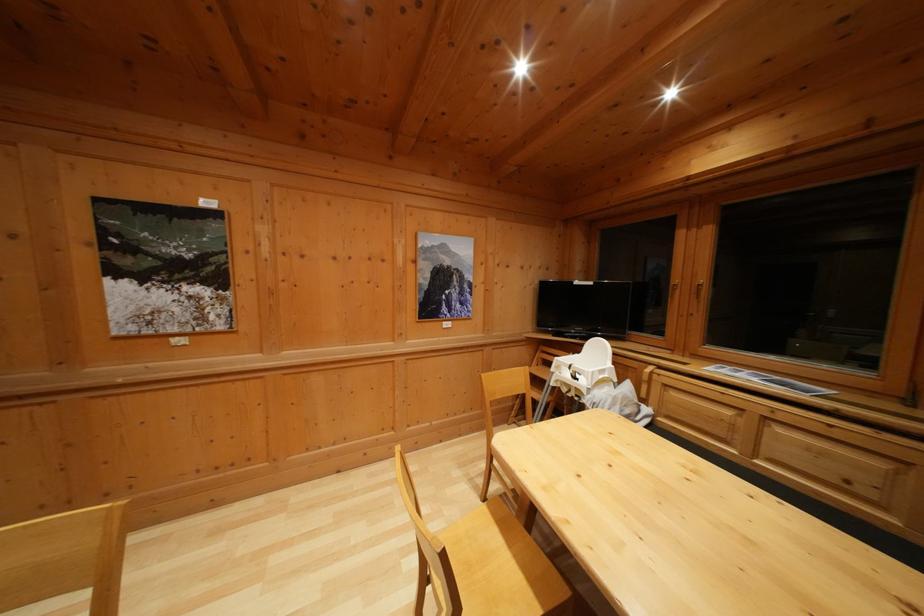
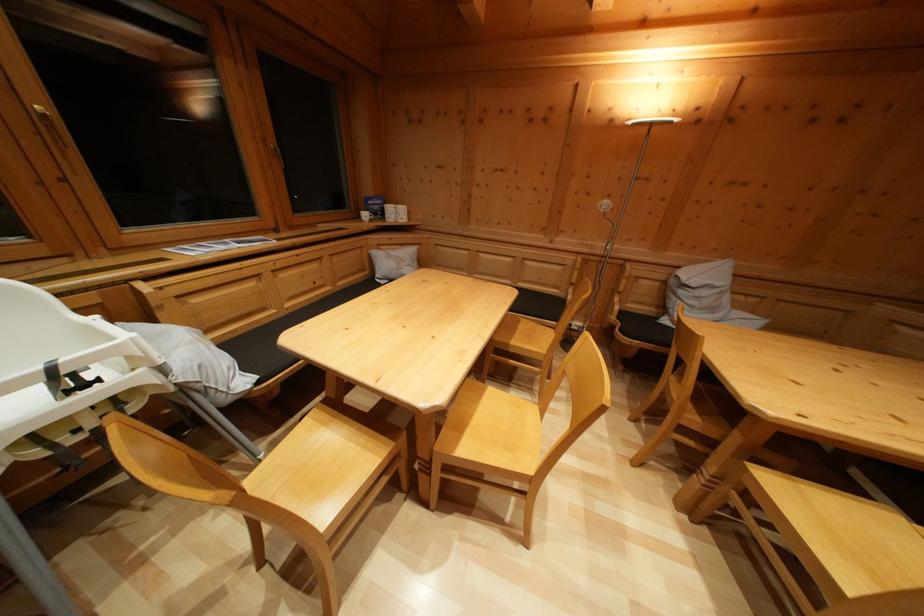
Locate, in the second image, the point that corresponds to pixel 704 297 in the first image.

(58, 135)